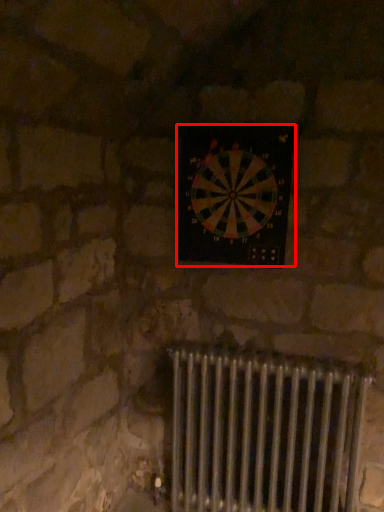
Question: From the image's perspective, considering the relative positions of wall clock (annotated by the red box) and radiator in the image provided, where is wall clock (annotated by the red box) located with respect to the staircase?

Choices:
 (A) above
 (B) below

Answer: (A)